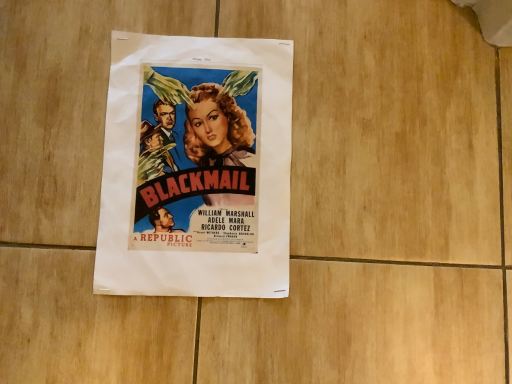
Image resolution: width=512 pixels, height=384 pixels. I want to click on matte paper poster at center, so click(134, 176).

Describe the element at coordinates (134, 176) in the screenshot. This screenshot has height=384, width=512. I see `matte paper poster at center` at that location.

Find the location of a particular element. matte paper poster at center is located at coordinates (134, 176).